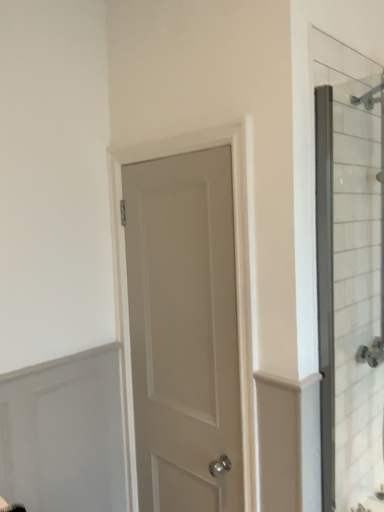
Question: Considering the relative sizes of white matte door at center and clear glass shower door at right in the image provided, is white matte door at center thinner than clear glass shower door at right?

Choices:
 (A) yes
 (B) no

Answer: (B)

Question: Is the position of white matte door at center less distant than that of clear glass shower door at right?

Choices:
 (A) yes
 (B) no

Answer: (B)

Question: Is white matte door at center oriented away from clear glass shower door at right?

Choices:
 (A) yes
 (B) no

Answer: (B)

Question: Does white matte door at center have a smaller size compared to clear glass shower door at right?

Choices:
 (A) yes
 (B) no

Answer: (B)

Question: From the image's perspective, is white matte door at center beneath clear glass shower door at right?

Choices:
 (A) yes
 (B) no

Answer: (A)

Question: Is white matte door at center wider than clear glass shower door at right?

Choices:
 (A) no
 (B) yes

Answer: (B)

Question: Would you consider clear glass shower door at right to be distant from white matte door at center?

Choices:
 (A) yes
 (B) no

Answer: (B)

Question: From the image's perspective, is clear glass shower door at right on white matte door at center?

Choices:
 (A) yes
 (B) no

Answer: (A)

Question: Is clear glass shower door at right oriented away from white matte door at center?

Choices:
 (A) no
 (B) yes

Answer: (A)

Question: Does clear glass shower door at right turn towards white matte door at center?

Choices:
 (A) yes
 (B) no

Answer: (B)

Question: Is clear glass shower door at right at the right side of white matte door at center?

Choices:
 (A) yes
 (B) no

Answer: (A)

Question: Is clear glass shower door at right taller than white matte door at center?

Choices:
 (A) yes
 (B) no

Answer: (B)

Question: From a real-world perspective, is clear glass shower door at right above or below white matte door at center?

Choices:
 (A) below
 (B) above

Answer: (B)